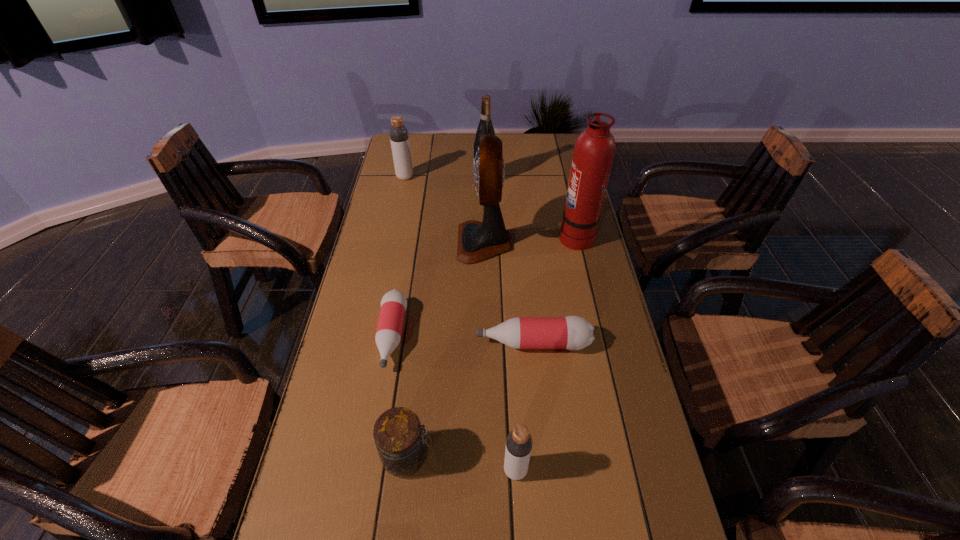
I want to click on the shortest bottle, so click(x=393, y=304).

This screenshot has height=540, width=960. What are the coordinates of `the left pink bottle` in the screenshot? It's located at (393, 304).

This screenshot has height=540, width=960. Identify the location of free space located 0.200m on the label side of the fire extinguisher. (498, 235).

Locate an element on the screen. vacant space located on the label side of the fire extinguisher is located at coordinates (498, 235).

The height and width of the screenshot is (540, 960). I want to click on vacant space located on the label side of the fire extinguisher, so click(449, 235).

Identify the location of vacant space located on the front-facing side of the fan. The height and width of the screenshot is (540, 960). (433, 242).

Where is `free space located 0.240m on the front-facing side of the fan`? free space located 0.240m on the front-facing side of the fan is located at coordinates (384, 242).

At what (x,y) coordinates should I click in order to perform the action: click on vacant space situated on the front-facing side of the fan. Please return your answer as a coordinate pair (x, y). The width and height of the screenshot is (960, 540). Looking at the image, I should click on (430, 242).

Where is `free location located on the right of the wine bottle`? free location located on the right of the wine bottle is located at coordinates click(x=569, y=180).

Where is `free spot located 0.170m on the back of the farthest bottle`? free spot located 0.170m on the back of the farthest bottle is located at coordinates coord(411,150).